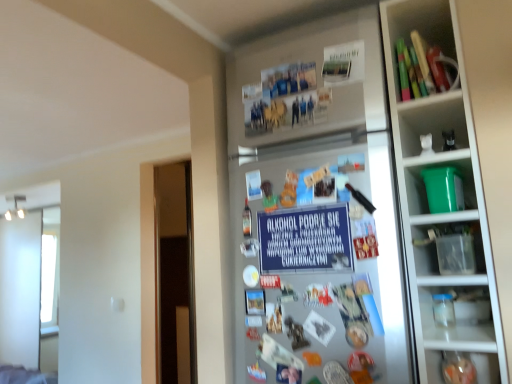
Question: Is blue paper sign at center oriented away from silver metallic fridge at center?

Choices:
 (A) yes
 (B) no

Answer: (A)

Question: Is blue paper sign at center positioned beyond the bounds of silver metallic fridge at center?

Choices:
 (A) yes
 (B) no

Answer: (B)

Question: Is silver metallic fridge at center surrounded by blue paper sign at center?

Choices:
 (A) no
 (B) yes

Answer: (A)

Question: Is the position of blue paper sign at center less distant than that of silver metallic fridge at center?

Choices:
 (A) no
 (B) yes

Answer: (A)

Question: Are blue paper sign at center and silver metallic fridge at center located far from each other?

Choices:
 (A) yes
 (B) no

Answer: (B)

Question: From a real-world perspective, is blue paper sign at center located higher than silver metallic fridge at center?

Choices:
 (A) yes
 (B) no

Answer: (A)

Question: Is silver metallic fridge at center at the right side of blue paper sign at center?

Choices:
 (A) yes
 (B) no

Answer: (A)

Question: Is blue paper sign at center a part of silver metallic fridge at center?

Choices:
 (A) yes
 (B) no

Answer: (A)

Question: Does silver metallic fridge at center lie in front of blue paper sign at center?

Choices:
 (A) yes
 (B) no

Answer: (A)

Question: From a real-world perspective, is silver metallic fridge at center positioned under blue paper sign at center based on gravity?

Choices:
 (A) yes
 (B) no

Answer: (A)

Question: Could you tell me if silver metallic fridge at center is facing blue paper sign at center?

Choices:
 (A) no
 (B) yes

Answer: (B)

Question: Is silver metallic fridge at center far away from blue paper sign at center?

Choices:
 (A) no
 (B) yes

Answer: (A)

Question: From the image's perspective, is blue paper sign at center beneath green plastic bucket at right, positioned as the 1th shelf in bottom-to-top order?

Choices:
 (A) no
 (B) yes

Answer: (B)